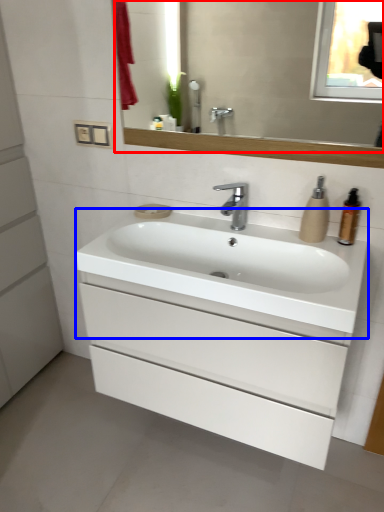
Question: Which point is further to the camera, mirror (highlighted by a red box) or counter top (highlighted by a blue box)?

Choices:
 (A) mirror
 (B) counter top

Answer: (A)